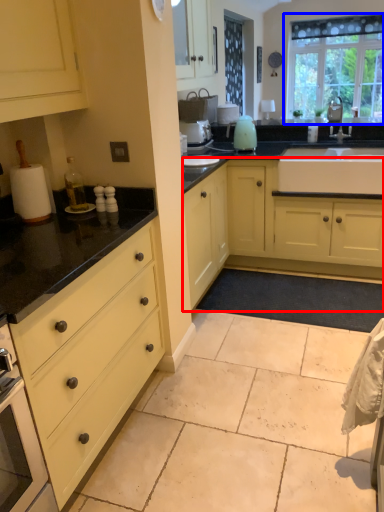
Question: Which of the following is the farthest to the observer, cabinetry (highlighted by a red box) or window (highlighted by a blue box)?

Choices:
 (A) cabinetry
 (B) window

Answer: (B)